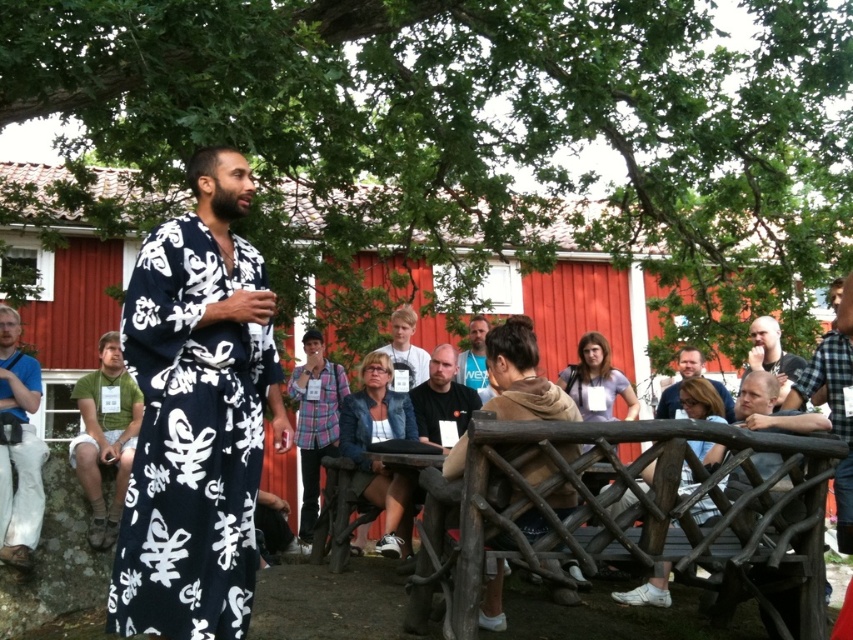
Question: Does brown leather jacket at center appear over light brown wooden bench at lower right?

Choices:
 (A) yes
 (B) no

Answer: (A)

Question: Is light brown wooden bench at lower right thinner than light brown wooden chair at center?

Choices:
 (A) no
 (B) yes

Answer: (B)

Question: Among these points, which one is farthest from the camera?

Choices:
 (A) (450, 404)
 (B) (848, 496)
 (C) (662, 604)
 (D) (793, 378)

Answer: (A)

Question: Which point is closer to the camera?

Choices:
 (A) checkered fabric shirt at right
 (B) light brown wooden chair at center
 (C) light brown wooden bench at lower right
 (D) brown leather jacket at center

Answer: (D)

Question: Does plaid fabric shirt at center lie behind smooth brown leather jacket at lower right?

Choices:
 (A) no
 (B) yes

Answer: (B)

Question: Estimate the real-world distances between objects in this image. Which object is farther from the light brown wooden chair at center?

Choices:
 (A) light brown wooden bench at lower right
 (B) smooth brown leather jacket at lower right

Answer: (A)